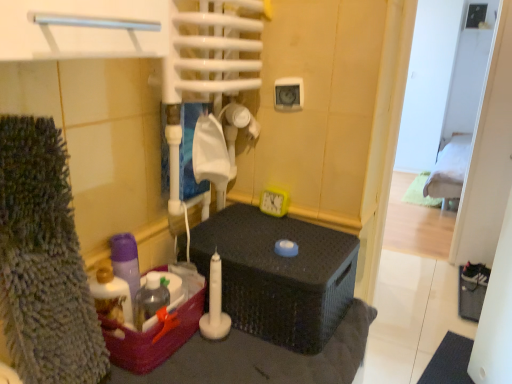
I want to click on free point above translucent plastic basket at lower left (from a real-world perspective), so click(x=154, y=297).